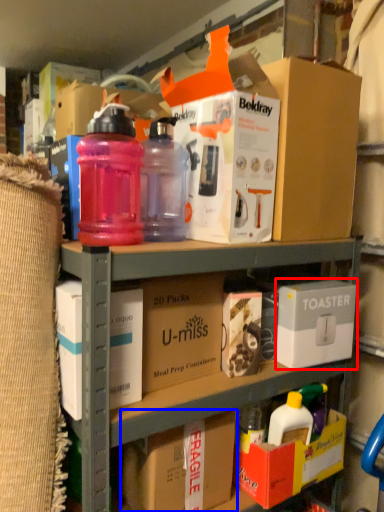
Question: Which object appears closest to the camera in this image, storage box (highlighted by a red box) or cardboard box (highlighted by a blue box)?

Choices:
 (A) storage box
 (B) cardboard box

Answer: (B)